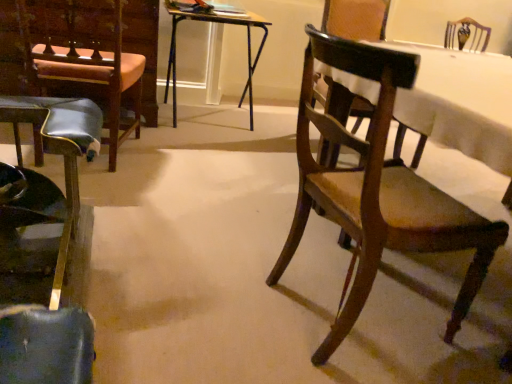
Where is `vacant area that lies to the right of leather seat at left, the second armchair viewed from the right`? This screenshot has width=512, height=384. vacant area that lies to the right of leather seat at left, the second armchair viewed from the right is located at coordinates (179, 165).